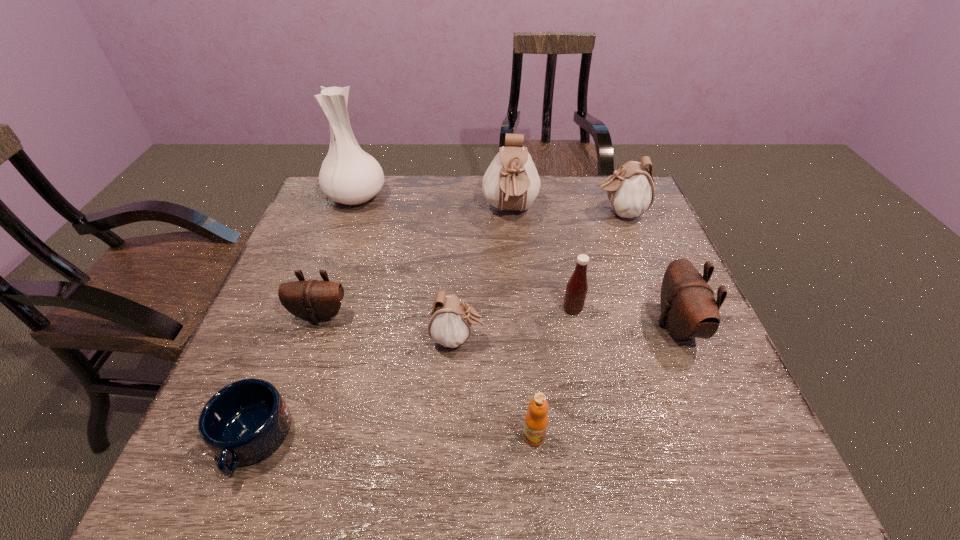
Locate an element on the screen. This screenshot has height=540, width=960. mug present at the left edge is located at coordinates (243, 423).

Image resolution: width=960 pixels, height=540 pixels. Identify the location of object at the far left corner. (348, 175).

The height and width of the screenshot is (540, 960). Identify the location of object that is positioned at the near left corner. (243, 423).

The width and height of the screenshot is (960, 540). I want to click on object that is at the far right corner, so click(x=630, y=190).

In the image, there is a desktop. Find the location of `blank space at the far edge`. blank space at the far edge is located at coordinates (568, 175).

This screenshot has width=960, height=540. I want to click on free space at the near edge, so click(x=466, y=451).

In the image, there is a desktop. Identify the location of blank space at the left edge. This screenshot has height=540, width=960. (317, 230).

In the image, there is a desktop. Identify the location of vacant area at the right edge. (670, 338).

Where is `vacant space that is in between the bigger brown pouch and the leftmost pouch`? The width and height of the screenshot is (960, 540). vacant space that is in between the bigger brown pouch and the leftmost pouch is located at coordinates (498, 320).

In order to click on vacant area that lies between the tallest object and the right brown pouch in this screenshot , I will do `click(516, 261)`.